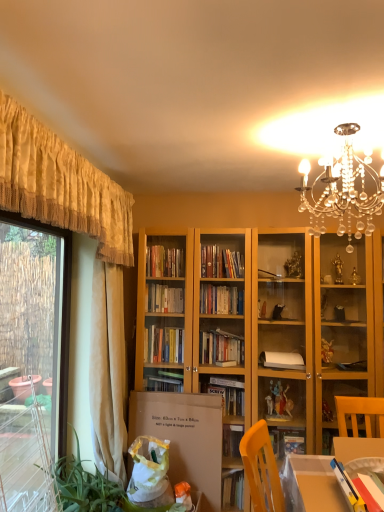
Question: Can you confirm if beige fabric curtain at left, which ranks as the second curtain in front-to-back order, is bigger than yellow fabric curtain at upper left, the first curtain viewed from the front?

Choices:
 (A) no
 (B) yes

Answer: (A)

Question: Is beige fabric curtain at left, which ranks as the second curtain in front-to-back order, positioned with its back to yellow fabric curtain at upper left, the second curtain viewed from the back?

Choices:
 (A) yes
 (B) no

Answer: (B)

Question: Is beige fabric curtain at left, which ranks as the second curtain in front-to-back order, to the left of yellow fabric curtain at upper left, the first curtain viewed from the front, from the viewer's perspective?

Choices:
 (A) yes
 (B) no

Answer: (B)

Question: From a real-world perspective, is beige fabric curtain at left, the first curtain from the back, located higher than yellow fabric curtain at upper left, the first curtain viewed from the front?

Choices:
 (A) no
 (B) yes

Answer: (A)

Question: From the image's perspective, does beige fabric curtain at left, which ranks as the second curtain in front-to-back order, appear lower than yellow fabric curtain at upper left, the second curtain viewed from the back?

Choices:
 (A) no
 (B) yes

Answer: (B)

Question: In terms of size, does transparent glass window at left appear bigger or smaller than clear crystal chandelier at upper center?

Choices:
 (A) small
 (B) big

Answer: (B)

Question: In the image, is transparent glass window at left on the left side or the right side of clear crystal chandelier at upper center?

Choices:
 (A) right
 (B) left

Answer: (B)

Question: Considering their positions, is transparent glass window at left located in front of or behind clear crystal chandelier at upper center?

Choices:
 (A) behind
 (B) front

Answer: (A)

Question: Is point (33, 387) closer or farther from the camera than point (319, 226)?

Choices:
 (A) closer
 (B) farther

Answer: (B)

Question: Is transparent glass window at left wider or thinner than cardboard box at lower left?

Choices:
 (A) wide
 (B) thin

Answer: (A)

Question: Relative to cardboard box at lower left, is transparent glass window at left in front or behind?

Choices:
 (A) behind
 (B) front

Answer: (B)

Question: Looking at the image, does transparent glass window at left seem bigger or smaller compared to cardboard box at lower left?

Choices:
 (A) big
 (B) small

Answer: (A)

Question: Considering the positions of transparent glass window at left and cardboard box at lower left in the image, is transparent glass window at left taller or shorter than cardboard box at lower left?

Choices:
 (A) tall
 (B) short

Answer: (A)

Question: Based on their sizes in the image, would you say beige fabric curtain at left, the first curtain from the back, is bigger or smaller than transparent glass window at left?

Choices:
 (A) big
 (B) small

Answer: (B)

Question: Would you say beige fabric curtain at left, the first curtain from the back, is to the left or to the right of transparent glass window at left in the picture?

Choices:
 (A) right
 (B) left

Answer: (A)